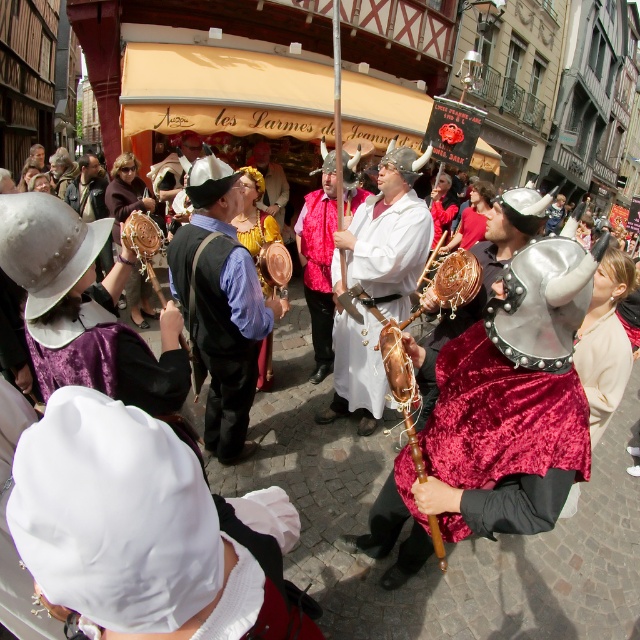
Question: Which point is farther to the camera?

Choices:
 (A) white satin bonnet at lower left
 (B) gold textured crown at center
 (C) wooden staff at lower right
 (D) velvet red vest at center

Answer: (B)

Question: Does velvet maroon skirt at center have a smaller size compared to velvet fabric hat at center?

Choices:
 (A) no
 (B) yes

Answer: (B)

Question: Which object appears farthest from the camera in this image?

Choices:
 (A) gold textured crown at center
 (B) velvet red vest at center
 (C) wooden carved drum at center

Answer: (A)

Question: Is velvet red vest at center below velvet fabric hat at center?

Choices:
 (A) yes
 (B) no

Answer: (A)

Question: Observing the image, what is the correct spatial positioning of velvet red vest at center in reference to velvet fabric hat at center?

Choices:
 (A) above
 (B) below

Answer: (B)

Question: Which point is closer to the camera?

Choices:
 (A) wooden staff at lower right
 (B) gold textured crown at center
 (C) wooden carved drum at center

Answer: (A)